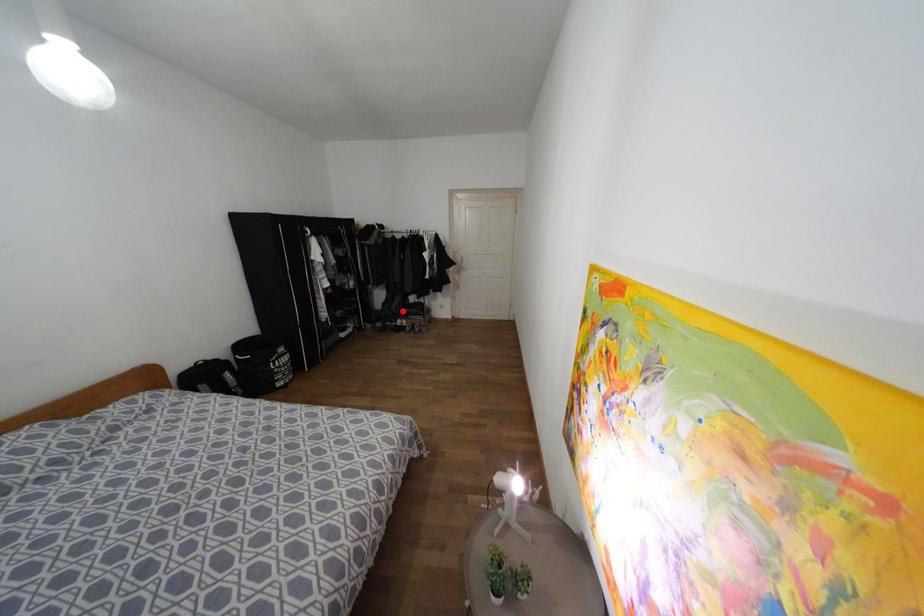
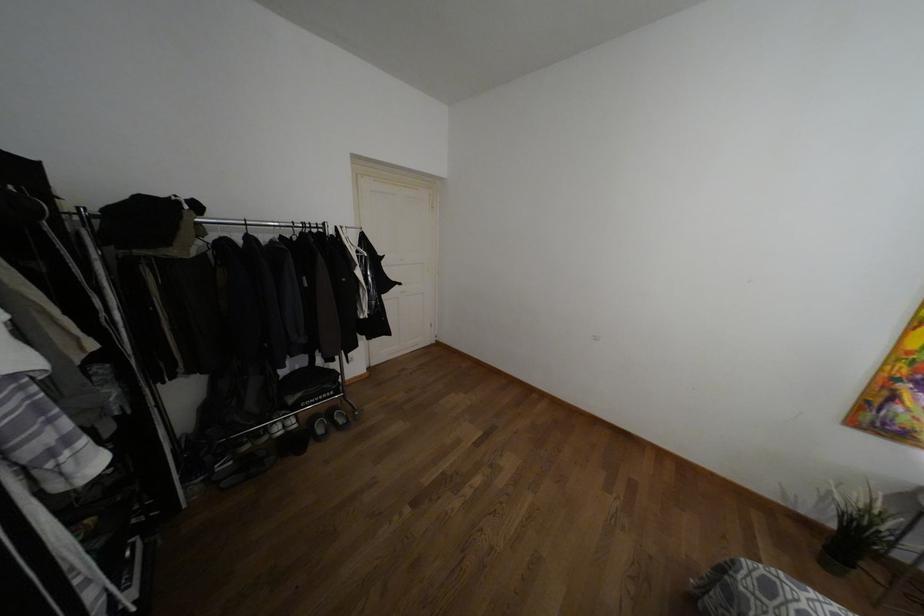
The point at the highlighted location is marked in the first image. Where is the corresponding point in the second image?

(290, 399)